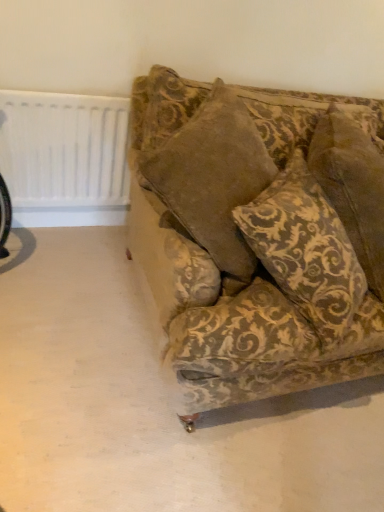
Question: Considering the relative sizes of velvet-patterned couch at center and white plastic radiator at upper left in the image provided, is velvet-patterned couch at center smaller than white plastic radiator at upper left?

Choices:
 (A) no
 (B) yes

Answer: (A)

Question: Is velvet-patterned couch at center next to white plastic radiator at upper left?

Choices:
 (A) yes
 (B) no

Answer: (B)

Question: Does velvet-patterned couch at center have a greater height compared to white plastic radiator at upper left?

Choices:
 (A) no
 (B) yes

Answer: (B)

Question: Is velvet-patterned couch at center positioned before white plastic radiator at upper left?

Choices:
 (A) no
 (B) yes

Answer: (B)

Question: From the image's perspective, does velvet-patterned couch at center appear higher than white plastic radiator at upper left?

Choices:
 (A) no
 (B) yes

Answer: (A)

Question: From the image's perspective, is white plastic radiator at upper left located above or below velvet-patterned couch at center?

Choices:
 (A) below
 (B) above

Answer: (B)

Question: Based on their positions, is white plastic radiator at upper left located to the left or right of velvet-patterned couch at center?

Choices:
 (A) left
 (B) right

Answer: (A)

Question: Based on their sizes in the image, would you say white plastic radiator at upper left is bigger or smaller than velvet-patterned couch at center?

Choices:
 (A) big
 (B) small

Answer: (B)

Question: From their relative heights in the image, would you say white plastic radiator at upper left is taller or shorter than velvet-patterned couch at center?

Choices:
 (A) tall
 (B) short

Answer: (B)

Question: Looking at their shapes, would you say velvet-patterned couch at center is wider or thinner than velvet gold-patterned pillow at center?

Choices:
 (A) wide
 (B) thin

Answer: (B)

Question: Is velvet-patterned couch at center in front of or behind velvet gold-patterned pillow at center in the image?

Choices:
 (A) front
 (B) behind

Answer: (A)

Question: Is velvet-patterned couch at center inside or outside of velvet gold-patterned pillow at center?

Choices:
 (A) outside
 (B) inside

Answer: (B)

Question: Considering the positions of point (238, 233) and point (334, 284), is point (238, 233) closer or farther from the camera than point (334, 284)?

Choices:
 (A) farther
 (B) closer

Answer: (A)

Question: Would you say velvet gold-patterned pillow at center is inside or outside white plastic radiator at upper left?

Choices:
 (A) inside
 (B) outside

Answer: (B)

Question: From a real-world perspective, is velvet gold-patterned pillow at center above or below white plastic radiator at upper left?

Choices:
 (A) below
 (B) above

Answer: (B)